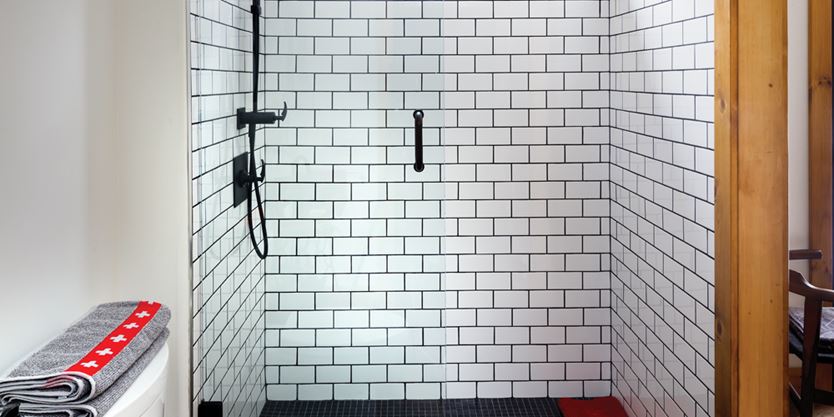
Image resolution: width=834 pixels, height=417 pixels. What are the coordinates of `white wall` in the screenshot? It's located at coord(62,218).